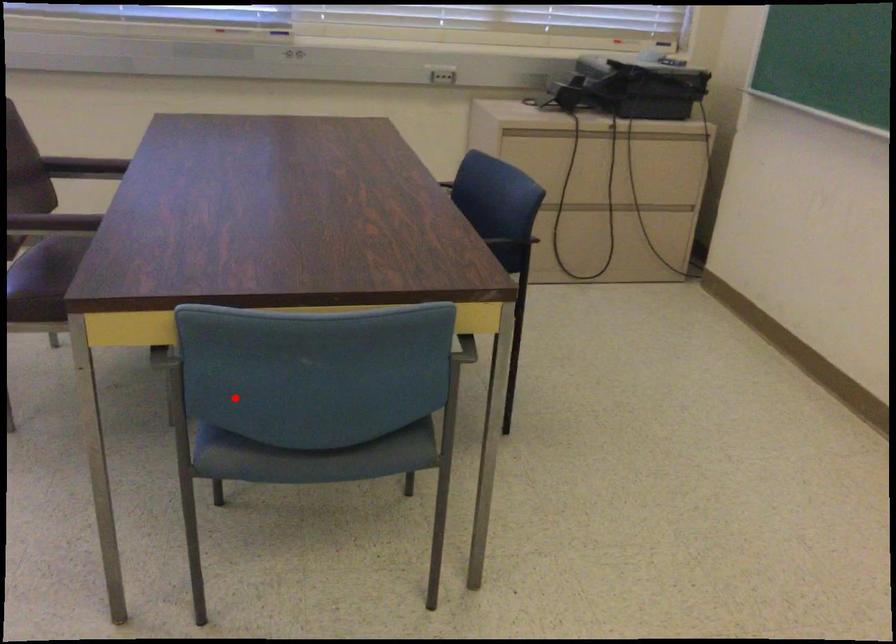
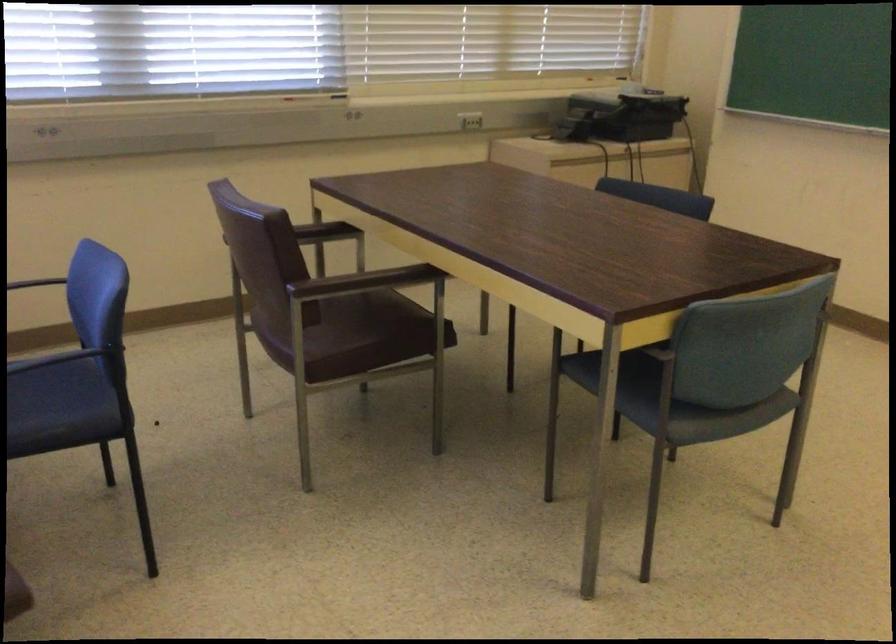
Where in the second image is the point corresponding to the highlighted location from the first image?

(625, 384)